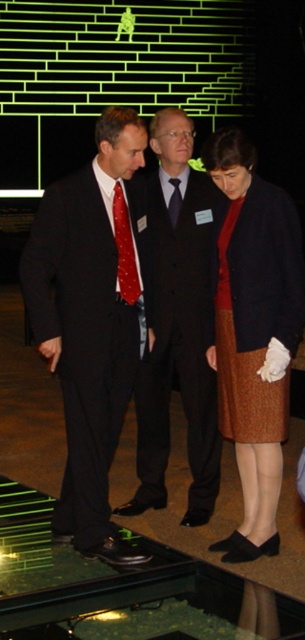
Question: Estimate the real-world distances between objects in this image. Which object is closer to the red dotted fabric tie at center?

Choices:
 (A) black silk tie at center
 (B) matte black suit at center

Answer: (B)

Question: Which point is farther to the camera?

Choices:
 (A) (83, 456)
 (B) (175, 225)
 (C) (255, 346)
 (D) (154, 508)

Answer: (D)

Question: Estimate the real-world distances between objects in this image. Which object is closer to the red dotted fabric tie at center?

Choices:
 (A) matte black suit at center
 (B) black silk tie at center
 (C) brown textured skirt at right
 (D) shiny black suit at center

Answer: (A)

Question: Where is matte black suit at center located in relation to brown textured skirt at right in the image?

Choices:
 (A) below
 (B) above

Answer: (B)

Question: Does red dotted fabric tie at center appear on the left side of black silk tie at center?

Choices:
 (A) yes
 (B) no

Answer: (A)

Question: Does red dotted fabric tie at center appear under black silk tie at center?

Choices:
 (A) yes
 (B) no

Answer: (A)